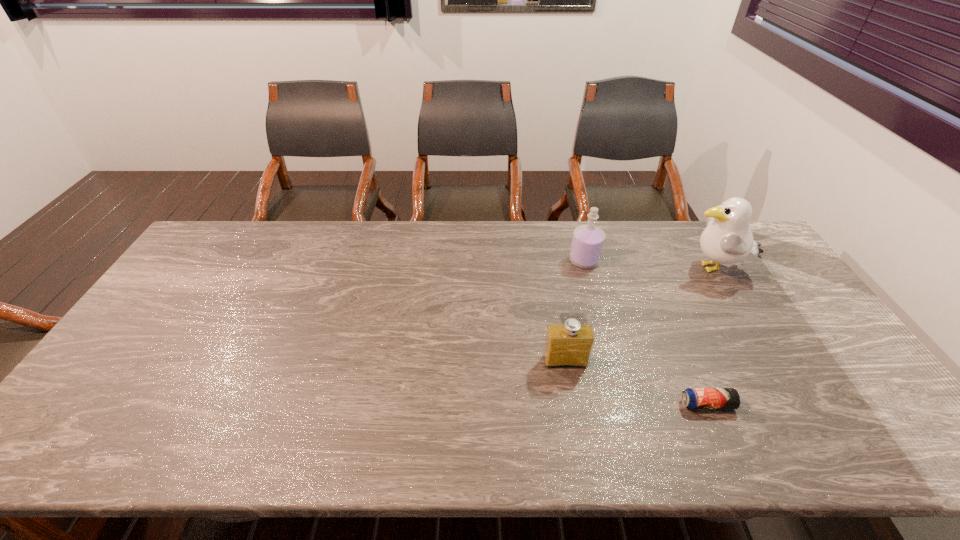
Locate an element on the screen. The width and height of the screenshot is (960, 540). vacant space located on the beak of the gull is located at coordinates (571, 269).

The image size is (960, 540). I want to click on vacant space situated on the right of the taller perfume, so click(617, 261).

What are the coordinates of `vacant area situated 0.120m on the front-facing side of the left perfume` in the screenshot? It's located at (574, 410).

Locate an element on the screen. The height and width of the screenshot is (540, 960). free space located on the right of the nearest object is located at coordinates (807, 404).

Locate an element on the screen. The height and width of the screenshot is (540, 960). gull situated at the far edge is located at coordinates (727, 239).

You are a GUI agent. You are given a task and a screenshot of the screen. Output one action in this format:
    pyautogui.click(x=<x>, y=<y>)
    Task: Click on the perfume at the far edge
    Image resolution: width=960 pixels, height=540 pixels.
    Given the screenshot: What is the action you would take?
    pyautogui.click(x=588, y=240)

Image resolution: width=960 pixels, height=540 pixels. What are the coordinates of `object present at the right edge` in the screenshot? It's located at (727, 239).

You are a GUI agent. You are given a task and a screenshot of the screen. Output one action in this format:
    pyautogui.click(x=<x>, y=<y>)
    Task: Click on the object that is at the far right corner
    Image resolution: width=960 pixels, height=540 pixels.
    Given the screenshot: What is the action you would take?
    pyautogui.click(x=727, y=239)

Identify the location of vacant space at the far edge of the desktop. (626, 252).

Identify the location of free space at the near edge. This screenshot has width=960, height=540. (336, 435).